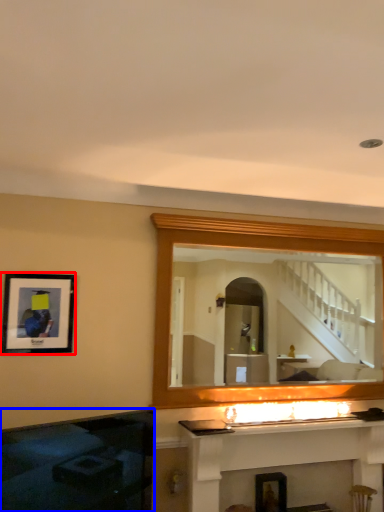
Question: Among these objects, which one is farthest to the camera, picture frame (highlighted by a red box) or fireplace (highlighted by a blue box)?

Choices:
 (A) picture frame
 (B) fireplace

Answer: (A)